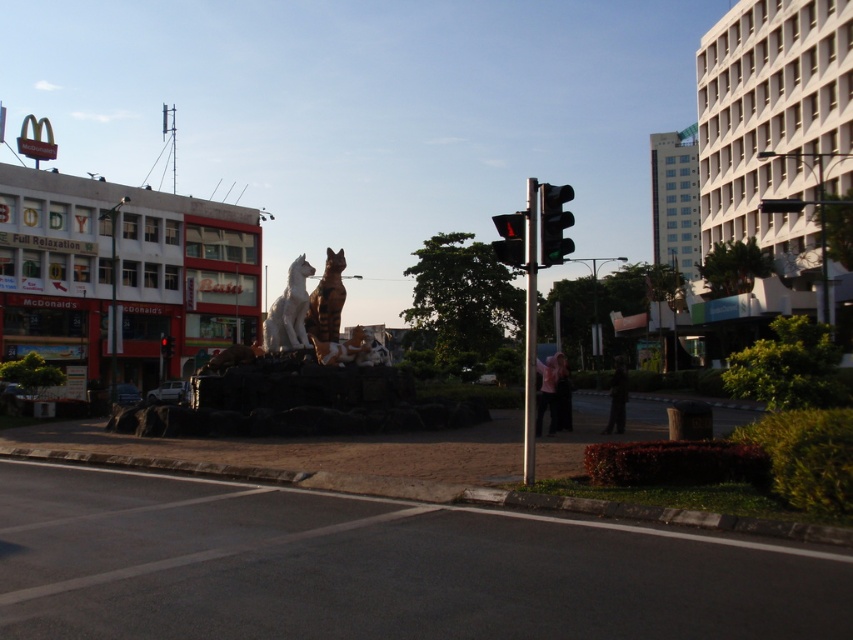
Describe the element at coordinates (376, 566) in the screenshot. I see `black asphalt at lower left` at that location.

In order to click on black asphalt at lower left in this screenshot , I will do `click(376, 566)`.

Is brown glossy statue at center thinner than green glass traffic light at upper right?

Yes, brown glossy statue at center is thinner than green glass traffic light at upper right.

Is brown glossy statue at center bigger than green glass traffic light at upper right?

No, brown glossy statue at center is not bigger than green glass traffic light at upper right.

Find the location of a particular element. The height and width of the screenshot is (640, 853). brown glossy statue at center is located at coordinates (326, 300).

How much distance is there between green glass traffic light at upper right and black plastic traffic light at upper right?

→ They are 39.10 feet apart.

Based on the photo, does green glass traffic light at upper right have a lesser width compared to black plastic traffic light at upper right?

Yes, green glass traffic light at upper right is thinner than black plastic traffic light at upper right.

What do you see at coordinates (554, 221) in the screenshot? I see `green glass traffic light at upper right` at bounding box center [554, 221].

Image resolution: width=853 pixels, height=640 pixels. I want to click on green glass traffic light at upper right, so click(554, 221).